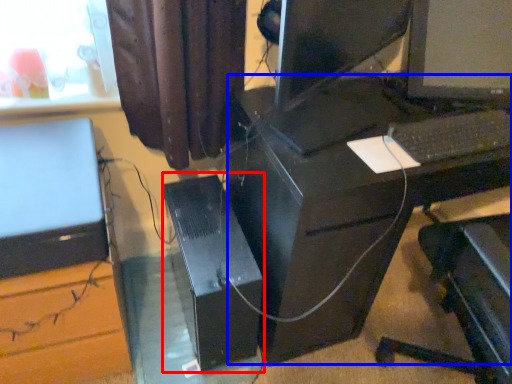
Question: Which object is further to the camera taking this photo, computer tower (highlighted by a red box) or computer desk (highlighted by a blue box)?

Choices:
 (A) computer tower
 (B) computer desk

Answer: (A)